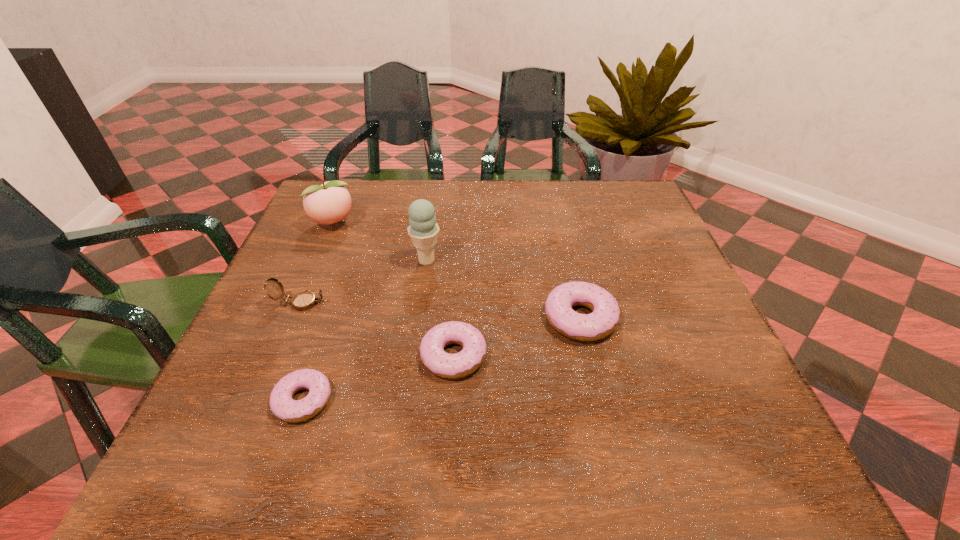
Locate which object ranks second in proximity to the third tallest object. Please provide its 2D coordinates. Your answer should be formatted as a tuple, i.e. [(x, y)], where the tuple contains the x and y coordinates of a point satisfying the conditions above.

[(423, 230)]

This screenshot has height=540, width=960. I want to click on the second closest doughnut relative to the compass, so pos(470,358).

Locate which doughnut ranks in proximity to the ice cream. Please provide its 2D coordinates. Your answer should be formatted as a tuple, i.e. [(x, y)], where the tuple contains the x and y coordinates of a point satisfying the conditions above.

[(470, 358)]

At what (x,y) coordinates should I click in order to perform the action: click on free space that satisfies the following two spatial constraints: 1. on the front side of the fifth tallest object; 2. on the left side of the peach. Please return your answer as a coordinate pair (x, y). The height and width of the screenshot is (540, 960). Looking at the image, I should click on (277, 355).

Locate an element on the screen. This screenshot has width=960, height=540. free space in the image that satisfies the following two spatial constraints: 1. on the face of the fifth tallest object; 2. on the left side of the third tallest object is located at coordinates (278, 355).

Locate an element on the screen. Image resolution: width=960 pixels, height=540 pixels. free location that satisfies the following two spatial constraints: 1. on the face of the fourth shortest object; 2. on the back side of the leftmost doughnut is located at coordinates (259, 400).

This screenshot has width=960, height=540. Identify the location of free location that satisfies the following two spatial constraints: 1. on the face of the fourth shortest object; 2. on the back side of the tallest doughnut. (294, 318).

The height and width of the screenshot is (540, 960). Find the location of `free space that satisfies the following two spatial constraints: 1. on the back side of the fifth tallest object; 2. on the face of the compass`. free space that satisfies the following two spatial constraints: 1. on the back side of the fifth tallest object; 2. on the face of the compass is located at coordinates (457, 303).